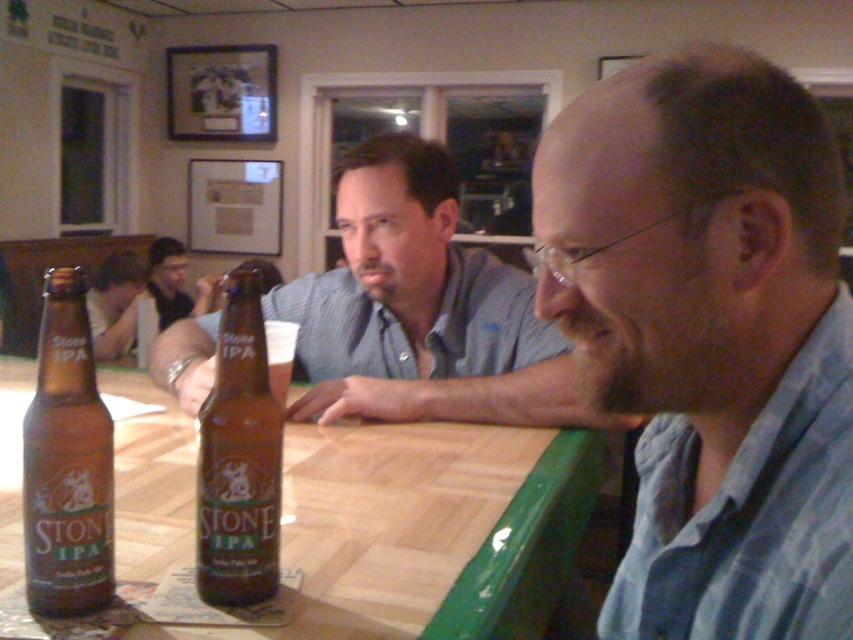
You are a photographer trying to capture a closeup shot of the wooden table at center without including the smooth skin face at lower left in the frame. Based on their positions, is this possible?

The wooden table at center is positioned under the smooth skin face at lower left, so adjusting the camera angle downward might exclude the face while focusing on the table.

You are standing at the entrance of the bar and want to sit at the wooden table at center. Which direction should you walk to reach it?

To reach the wooden table at center, you should walk towards the point at coordinates approximately 0.830 on the x axis and 0.502 on the y axis.

Consider the image. You are standing in front of the scene and want to locate the matte brown shirt at center. Can you describe its exact position using the coordinate system provided?

The matte brown shirt at center is located at the 2D coordinates point (711, 337).